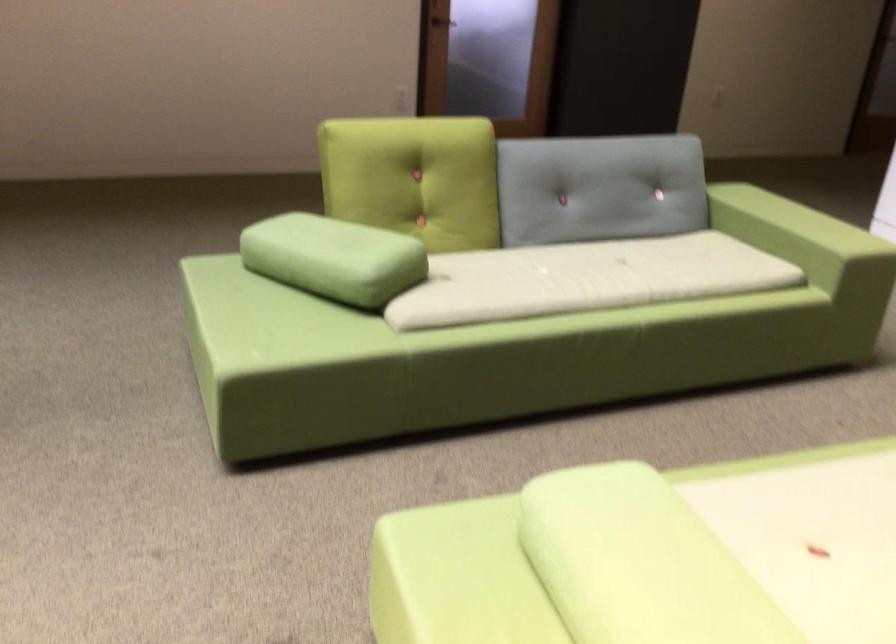
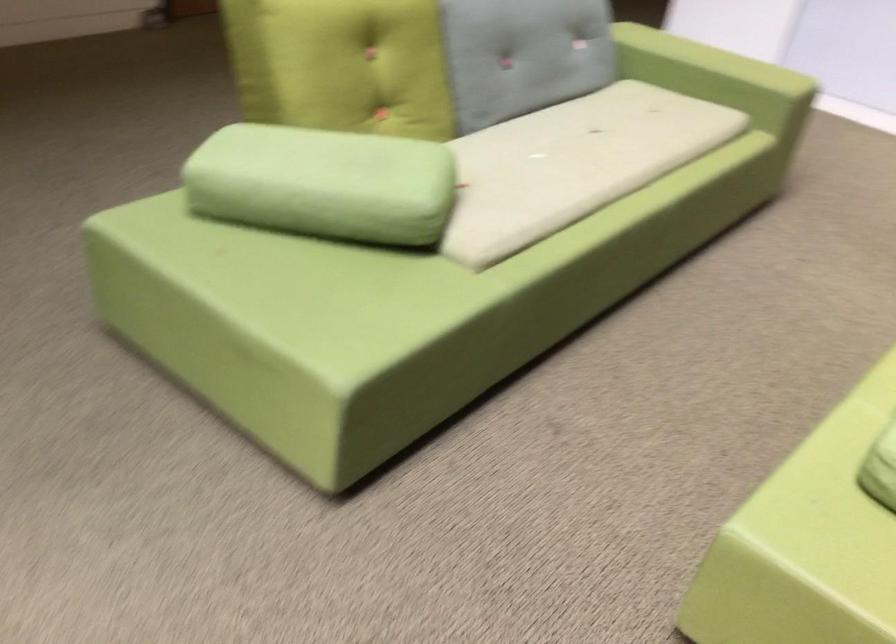
In the second image, find the point that corresponds to pixel 556 279 in the first image.

(572, 164)